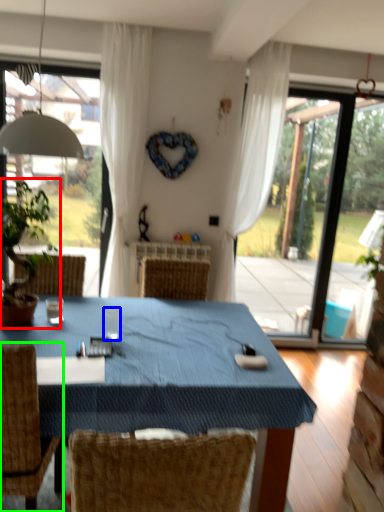
Question: Considering the real-world distances, which object is farthest from houseplant (highlighted by a red box)? coffee cup (highlighted by a blue box) or chair (highlighted by a green box)?

Choices:
 (A) coffee cup
 (B) chair

Answer: (B)